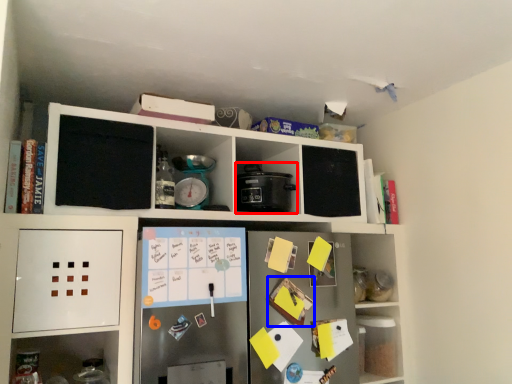
Question: Which object appears closest to the camera in this image, appliance (highlighted by a red box) or book (highlighted by a blue box)?

Choices:
 (A) appliance
 (B) book

Answer: (B)